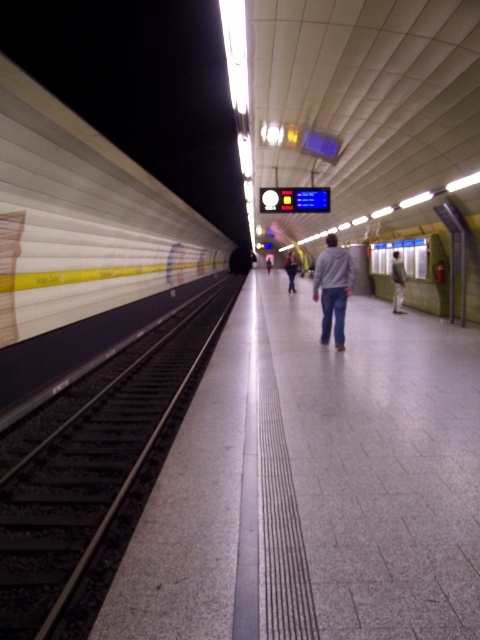
From the picture: Is gray hoodie at center above denim jacket at center?

No.

How distant is gray hoodie at center from denim jacket at center?

gray hoodie at center is 13.52 meters away from denim jacket at center.

Between point (335, 241) and point (295, 269), which one is positioned in front?

Positioned in front is point (335, 241).

Locate an element on the screen. The height and width of the screenshot is (640, 480). gray hoodie at center is located at coordinates (333, 289).

Between point (159, 269) and point (396, 296), which one is positioned in front?

Point (396, 296) is in front.

Does point (10, 310) come closer to viewer compared to point (404, 310)?

Yes, point (10, 310) is in front of point (404, 310).

Where is `white glossy platform at left`? white glossy platform at left is located at coordinates (82, 244).

Does black metal train track at left have a smaller size compared to gray hoodie at center?

Incorrect, black metal train track at left is not smaller in size than gray hoodie at center.

Where is `black metal train track at left`? This screenshot has width=480, height=640. black metal train track at left is located at coordinates (94, 474).

Who is more distant from viewer, (84, 500) or (333, 248)?

Positioned behind is point (333, 248).

Locate an element on the screen. black metal train track at left is located at coordinates (94, 474).